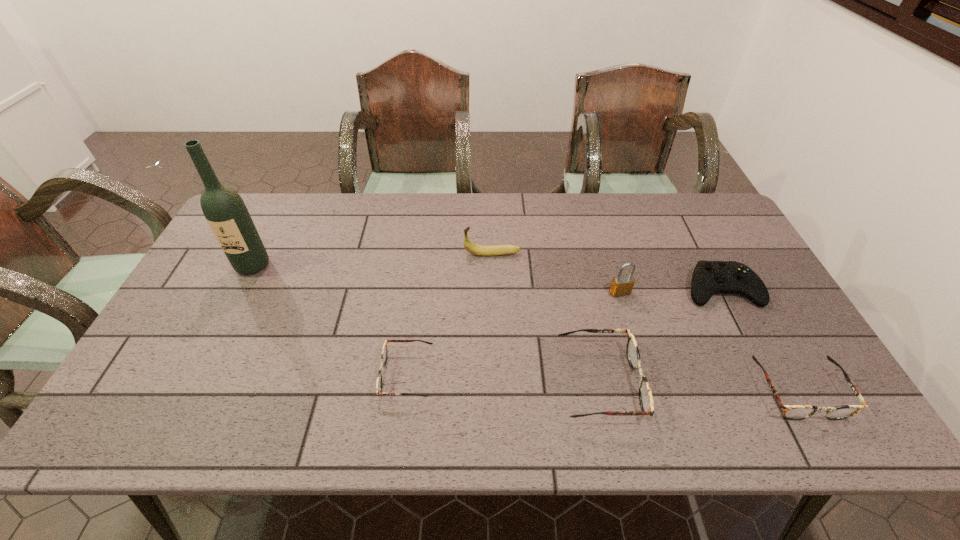
The height and width of the screenshot is (540, 960). What are the coordinates of `vacant space that's between the tallest object and the padlock` in the screenshot? It's located at (436, 279).

Locate an element on the screen. This screenshot has width=960, height=540. vacant area between the rightmost spectacles and the control is located at coordinates (759, 340).

The height and width of the screenshot is (540, 960). Find the location of `vacant area that lies between the banana and the tallest spectacles`. vacant area that lies between the banana and the tallest spectacles is located at coordinates click(x=546, y=318).

This screenshot has width=960, height=540. What are the coordinates of `vacant area between the shortest object and the second spectacles from left to right` in the screenshot? It's located at (503, 379).

At what (x,y) coordinates should I click in order to perform the action: click on unoccupied area between the second spectacles from right to left and the shortest spectacles. Please return your answer as a coordinate pair (x, y). Looking at the image, I should click on pos(503,379).

You are a GUI agent. You are given a task and a screenshot of the screen. Output one action in this format:
    pyautogui.click(x=<x>, y=<y>)
    Task: Click on the vacant space in between the fifth object from right to left and the shortest spectacles
    Image resolution: width=960 pixels, height=540 pixels.
    Given the screenshot: What is the action you would take?
    pyautogui.click(x=449, y=314)

Where is `empty space between the fifth object from right to left and the second tallest spectacles`? Image resolution: width=960 pixels, height=540 pixels. empty space between the fifth object from right to left and the second tallest spectacles is located at coordinates (645, 322).

The width and height of the screenshot is (960, 540). Identify the location of vacant area that lies between the second spectacles from right to left and the padlock. (610, 338).

Identify the location of object that ranks as the closest to the leftmost object. The image size is (960, 540). (384, 354).

The width and height of the screenshot is (960, 540). I want to click on object that is the closest one to the control, so click(621, 285).